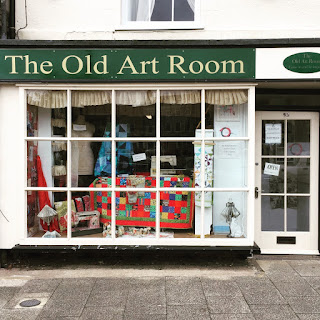
Locate an element on the screen. The height and width of the screenshot is (320, 320). door is located at coordinates (289, 185).